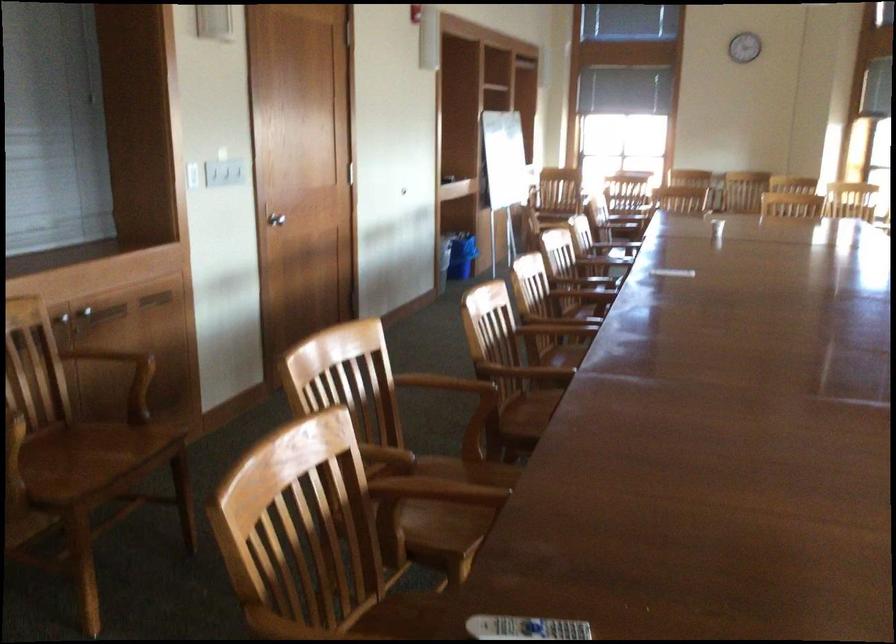
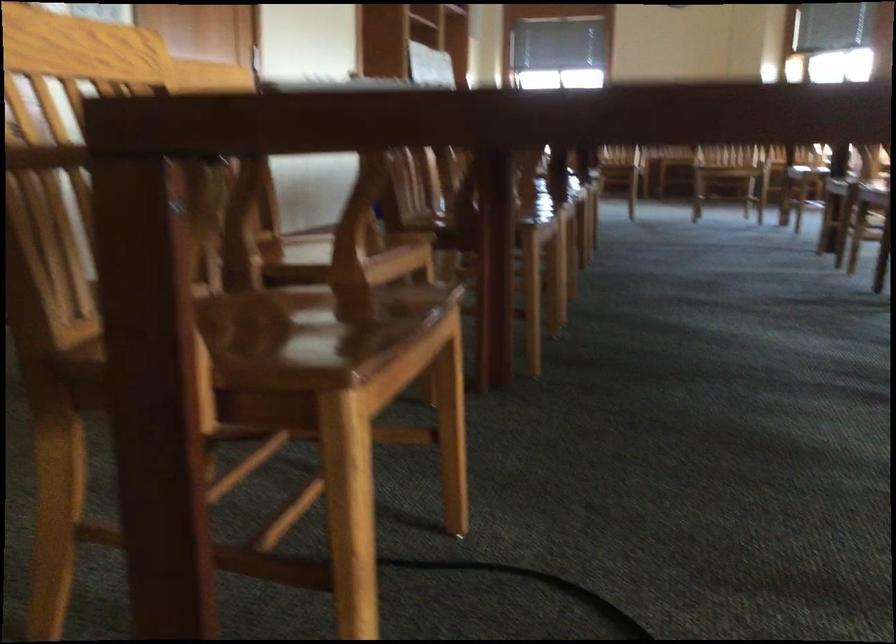
Question: Based on the continuous images, in which direction is the camera rotating? Reply with the corresponding letter.

Choices:
 (A) Left
 (B) Right
 (C) Up
 (D) Down

Answer: (C)